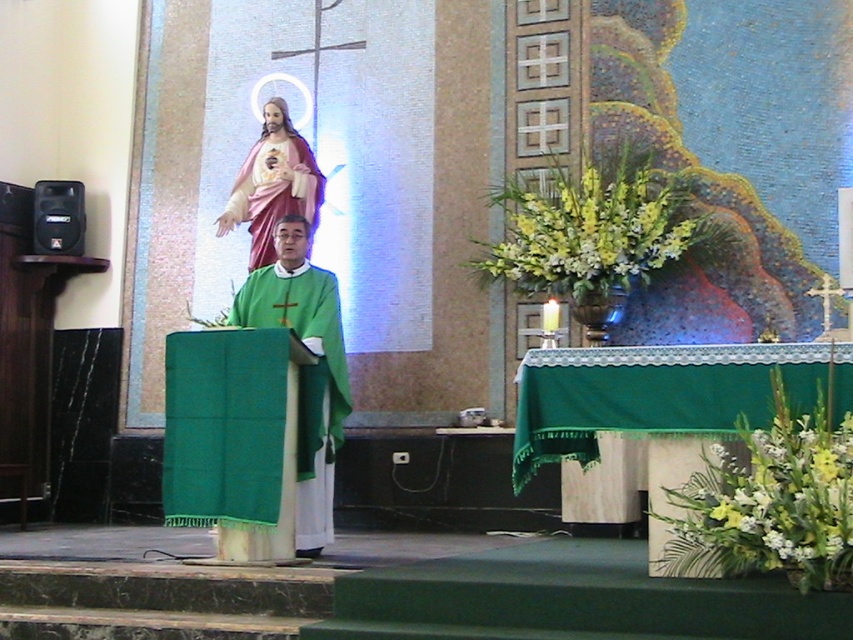
Question: Is green clothed priest at center smaller than matte pink fabric statue at upper center?

Choices:
 (A) yes
 (B) no

Answer: (B)

Question: Can you confirm if green clothed priest at center is positioned to the left of matte pink fabric statue at upper center?

Choices:
 (A) yes
 (B) no

Answer: (B)

Question: Can you confirm if green clothed priest at center is wider than matte pink fabric statue at upper center?

Choices:
 (A) yes
 (B) no

Answer: (B)

Question: Which point is closer to the camera taking this photo?

Choices:
 (A) (254, 193)
 (B) (338, 352)

Answer: (B)

Question: Which point is farther to the camera?

Choices:
 (A) green clothed priest at center
 (B) matte pink fabric statue at upper center

Answer: (B)